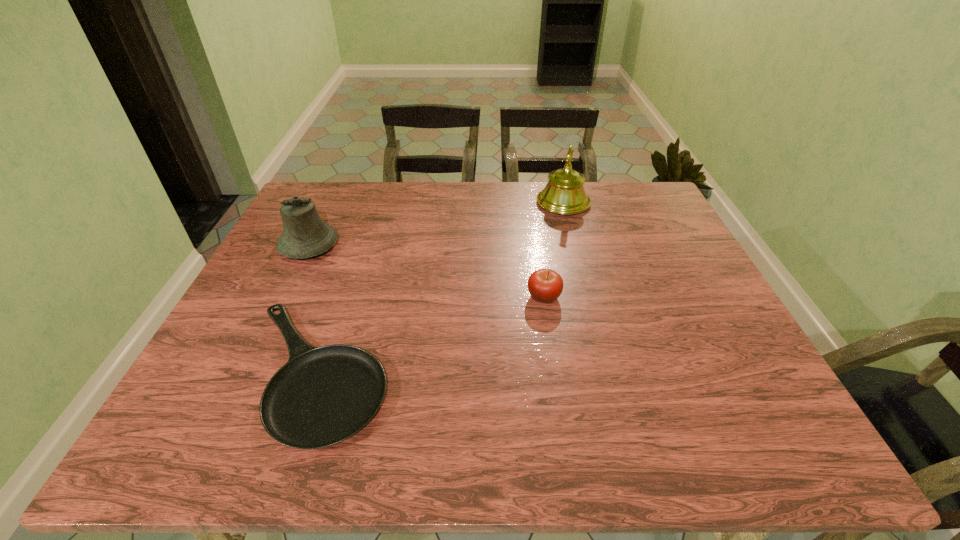
The height and width of the screenshot is (540, 960). In order to click on vacant space positioned on the left of the apple in this screenshot , I will do `click(383, 296)`.

Locate an element on the screen. This screenshot has width=960, height=540. free spot located on the right of the nearest object is located at coordinates (562, 372).

Locate an element on the screen. The width and height of the screenshot is (960, 540). object that is at the far edge is located at coordinates (564, 194).

Find the location of `object that is at the near edge`. object that is at the near edge is located at coordinates (322, 396).

You are a GUI agent. You are given a task and a screenshot of the screen. Output one action in this format:
    pyautogui.click(x=<x>, y=<y>)
    Task: Click on the bell that is at the left edge
    The height and width of the screenshot is (540, 960).
    Given the screenshot: What is the action you would take?
    pyautogui.click(x=305, y=235)

The height and width of the screenshot is (540, 960). I want to click on frying pan located in the left edge section of the desktop, so click(322, 396).

Identify the location of object present at the near left corner. This screenshot has height=540, width=960. (322, 396).

The height and width of the screenshot is (540, 960). In the image, there is a desktop. In order to click on free space at the far edge in this screenshot , I will do `click(367, 203)`.

Where is `vacant region at the near edge of the desktop`? vacant region at the near edge of the desktop is located at coordinates (695, 426).

Locate an element on the screen. vacant space at the left edge of the desktop is located at coordinates (185, 402).